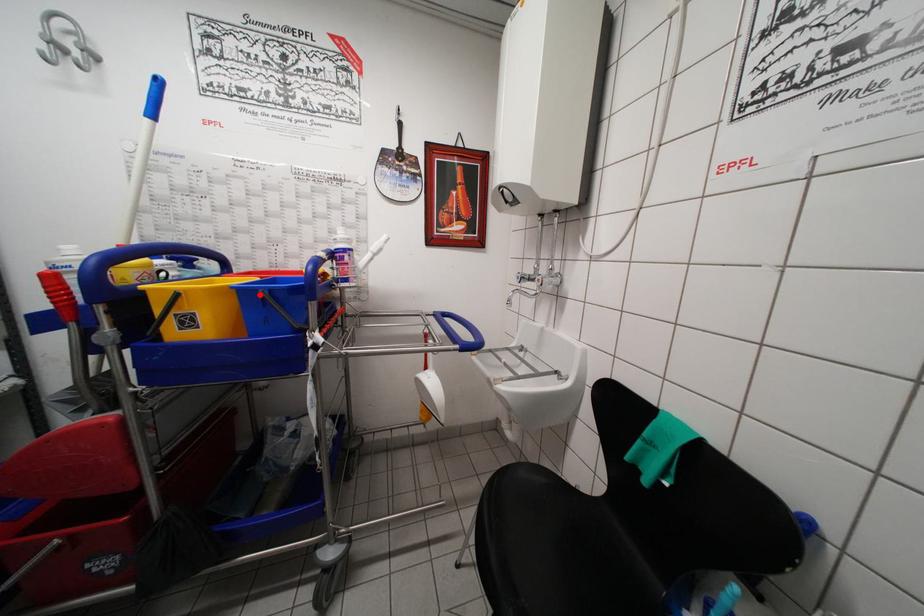
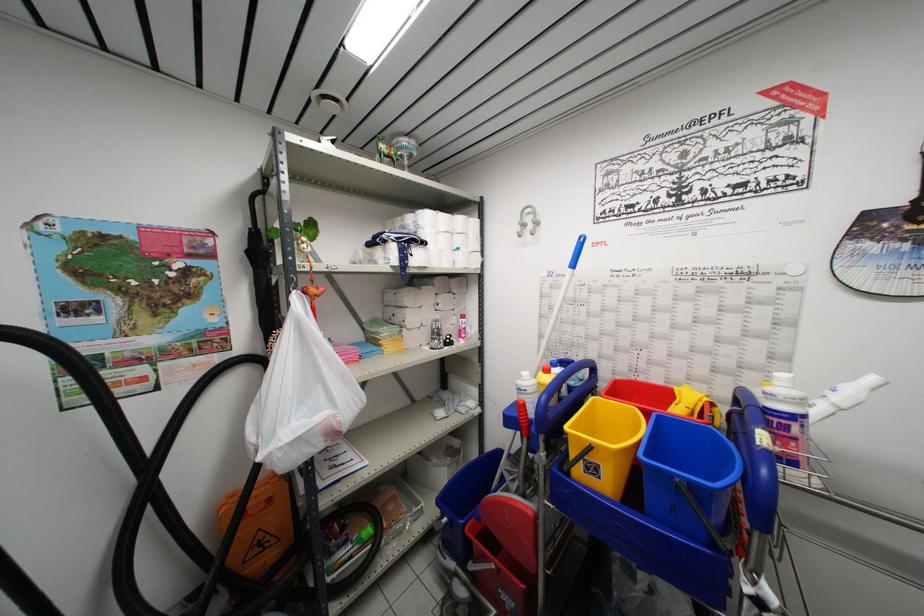
Find the pixel in the second image that matches the highlighted location in the first image.

(675, 479)